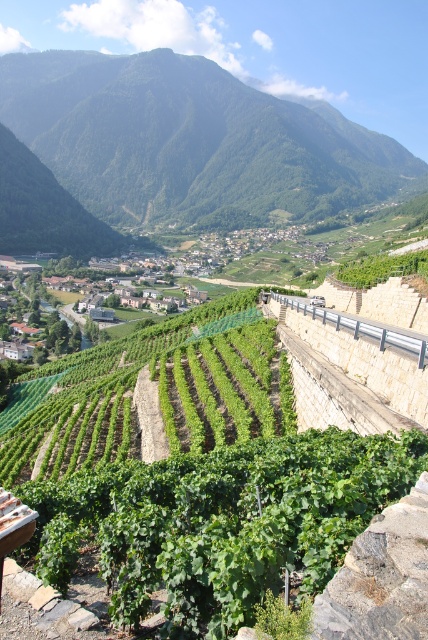
You are a hiker planning to take a photo of the green leafy vineyard at center. You want to include the green leafy hillside at upper center in the frame. Based on their heights, will the hillside block the view of the vineyard?

The green leafy hillside at upper center is taller than the green leafy vineyard at center, so it may block the view of the vineyard if positioned in front.

You are standing at the viewpoint overlooking the vineyards and want to reach the point marked as point (211, 65). Given that you can walk at a speed of 5 km per hour, how long would it take you to reach that point?

The point (211, 65) is 973.84 meters away from the viewer. To reach it at a walking speed of 5 km per hour, it would take approximately 19.5 minutes.

You are a hiker standing at the bottom of the hill looking up. Which object is higher up in the image, the green leafy hillside at upper center or the green leafy vineyard at center?

The green leafy hillside at upper center is positioned over the green leafy vineyard at center, so it is higher up.